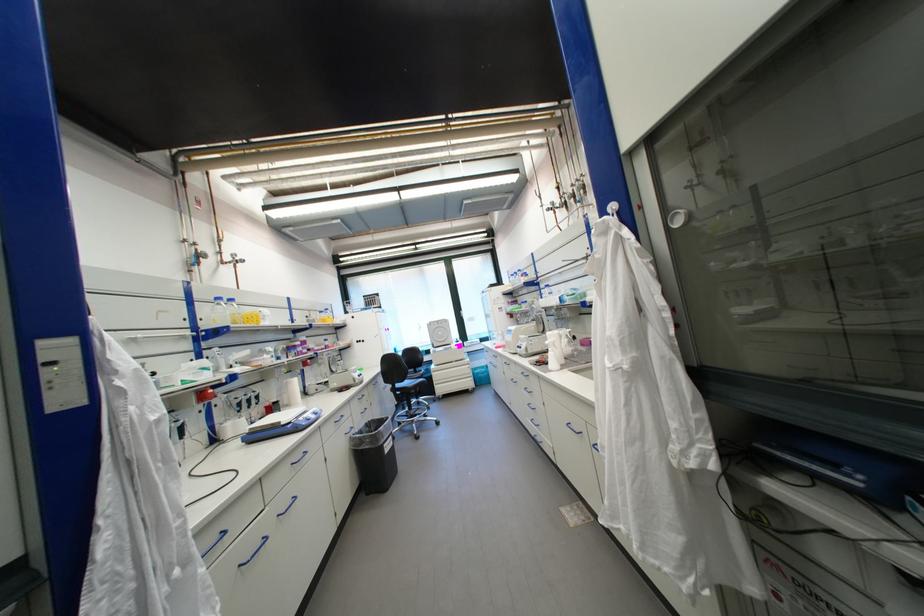
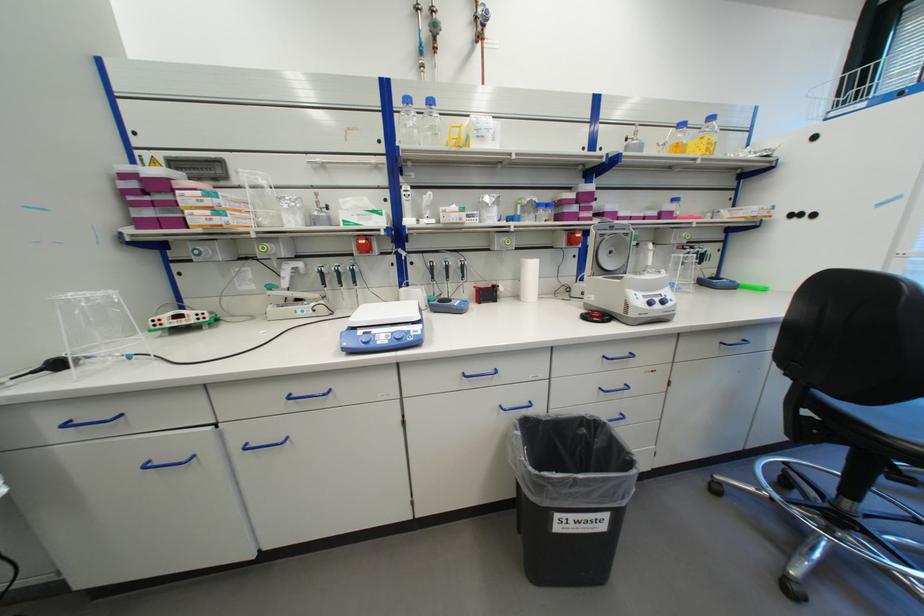
Find the pixel in the second image that matches (342,371) in the first image.

(616, 267)